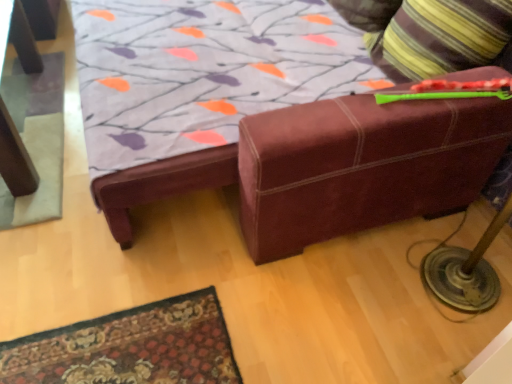
What do you see at coordinates (438, 36) in the screenshot? I see `striped fabric pillow at upper right` at bounding box center [438, 36].

Identify the location of striped fabric pillow at upper right. The height and width of the screenshot is (384, 512). (438, 36).

The width and height of the screenshot is (512, 384). What do you see at coordinates (36, 139) in the screenshot?
I see `gray felt mat at left` at bounding box center [36, 139].

You are a GUI agent. You are given a task and a screenshot of the screen. Output one action in this format:
    pyautogui.click(x=<x>, y=<y>)
    Task: Click on the gray felt mat at left
    
    Given the screenshot: What is the action you would take?
    pyautogui.click(x=36, y=139)

Identify the location of striped fabric pillow at upper right. The height and width of the screenshot is (384, 512). point(438,36).

Considering the relative positions of striped fabric pillow at upper right and gray felt mat at left in the image provided, is striped fabric pillow at upper right to the left of gray felt mat at left from the viewer's perspective?

No, striped fabric pillow at upper right is not to the left of gray felt mat at left.

In the image, is striped fabric pillow at upper right positioned in front of or behind gray felt mat at left?

Clearly, striped fabric pillow at upper right is in front of gray felt mat at left.

Which is closer to the camera, (428, 0) or (34, 93)?

Point (428, 0) is closer to the camera than point (34, 93).

From the picture: From the image's perspective, is striped fabric pillow at upper right positioned above or below gray felt mat at left?

Based on their image positions, striped fabric pillow at upper right is located above gray felt mat at left.

From a real-world perspective, who is located lower, striped fabric pillow at upper right or gray felt mat at left?

gray felt mat at left, from a real-world perspective.

Considering the sizes of objects striped fabric pillow at upper right and gray felt mat at left in the image provided, who is wider, striped fabric pillow at upper right or gray felt mat at left?

Wider between the two is gray felt mat at left.

Considering the relative sizes of striped fabric pillow at upper right and gray felt mat at left in the image provided, is striped fabric pillow at upper right taller than gray felt mat at left?

Yes.

Is striped fabric pillow at upper right smaller than gray felt mat at left?

Actually, striped fabric pillow at upper right might be larger than gray felt mat at left.

Is striped fabric pillow at upper right located outside gray felt mat at left?

That's correct, striped fabric pillow at upper right is outside of gray felt mat at left.

Is striped fabric pillow at upper right far away from gray felt mat at left?

striped fabric pillow at upper right is far away from gray felt mat at left.

Could you tell me if striped fabric pillow at upper right is turned towards gray felt mat at left?

Yes, striped fabric pillow at upper right is oriented towards gray felt mat at left.

How many degrees apart are the facing directions of striped fabric pillow at upper right and gray felt mat at left?

88.1 degrees.

The width and height of the screenshot is (512, 384). Find the location of `throw pillow above the gray felt mat at left (from the image's perspective)`. throw pillow above the gray felt mat at left (from the image's perspective) is located at coordinates (438, 36).

Between gray felt mat at left and striped fabric pillow at upper right, which one appears on the right side from the viewer's perspective?

Positioned to the right is striped fabric pillow at upper right.

Which object is further away from the camera taking this photo, gray felt mat at left or striped fabric pillow at upper right?

gray felt mat at left is further away from the camera.

Is point (17, 216) positioned before point (376, 18)?

Yes, it is.

From the image's perspective, is gray felt mat at left below striped fabric pillow at upper right?

Yes, from the image's perspective, gray felt mat at left is below striped fabric pillow at upper right.

From a real-world perspective, which is physically above, gray felt mat at left or striped fabric pillow at upper right?

striped fabric pillow at upper right.

Consider the image. Between gray felt mat at left and striped fabric pillow at upper right, which one has larger width?

gray felt mat at left is wider.

Which of these two, gray felt mat at left or striped fabric pillow at upper right, stands taller?

striped fabric pillow at upper right.

Between gray felt mat at left and striped fabric pillow at upper right, which one has smaller size?

With smaller size is gray felt mat at left.

Is gray felt mat at left not within striped fabric pillow at upper right?

That's correct, gray felt mat at left is outside of striped fabric pillow at upper right.

Are gray felt mat at left and striped fabric pillow at upper right beside each other?

No, gray felt mat at left is not making contact with striped fabric pillow at upper right.

Does gray felt mat at left turn towards striped fabric pillow at upper right?

No, gray felt mat at left is not aimed at striped fabric pillow at upper right.

How far apart are gray felt mat at left and striped fabric pillow at upper right?

gray felt mat at left is 1.60 meters from striped fabric pillow at upper right.

This screenshot has width=512, height=384. In order to click on throw pillow above the gray felt mat at left (from the image's perspective) in this screenshot , I will do `click(438, 36)`.

You are a GUI agent. You are given a task and a screenshot of the screen. Output one action in this format:
    pyautogui.click(x=<x>, y=<y>)
    Task: Click on the mat below the striped fabric pillow at upper right (from a real-world perspective)
    
    Given the screenshot: What is the action you would take?
    pyautogui.click(x=36, y=139)

At what (x,y) coordinates should I click in order to perform the action: click on throw pillow above the gray felt mat at left (from a real-world perspective). Please return your answer as a coordinate pair (x, y). The height and width of the screenshot is (384, 512). Looking at the image, I should click on (438, 36).